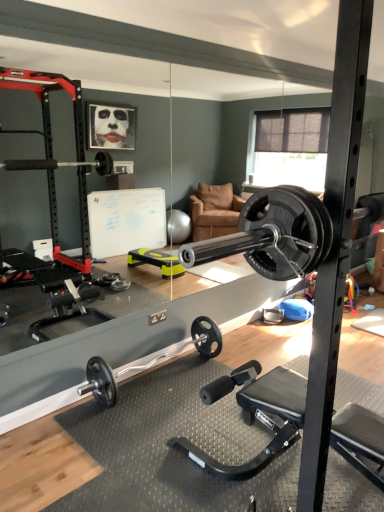
Find the location of a particular element. This screenshot has height=512, width=384. vacant space in front of black rubber dumbbell at center is located at coordinates (150, 442).